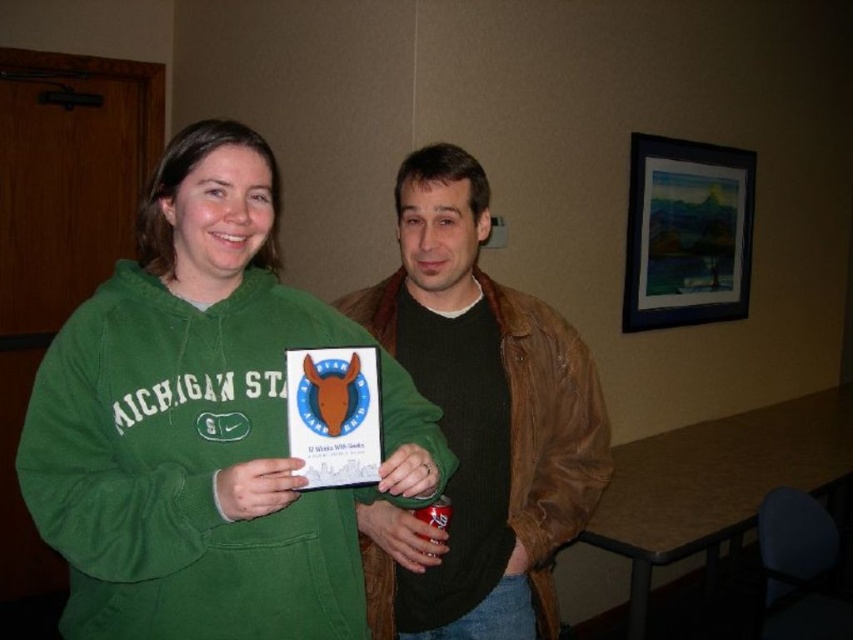
Does point (80, 451) come behind point (380, 342)?

No, (80, 451) is in front of (380, 342).

In the scene shown: Does green fleece sweatshirt at center appear under brown leather jacket at center?

No, green fleece sweatshirt at center is not below brown leather jacket at center.

The width and height of the screenshot is (853, 640). What do you see at coordinates (204, 426) in the screenshot?
I see `green fleece sweatshirt at center` at bounding box center [204, 426].

You are a GUI agent. You are given a task and a screenshot of the screen. Output one action in this format:
    pyautogui.click(x=<x>, y=<y>)
    Task: Click on the green fleece sweatshirt at center
    Image resolution: width=853 pixels, height=640 pixels.
    Given the screenshot: What is the action you would take?
    pyautogui.click(x=204, y=426)